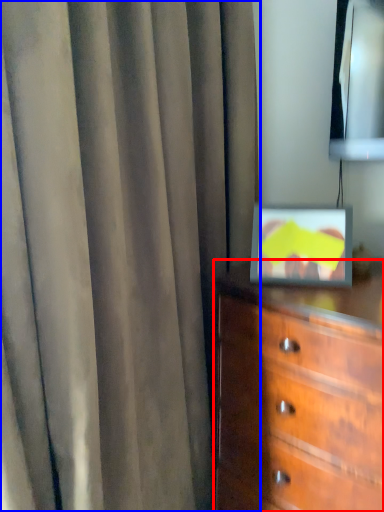
Question: Which object is closer to the camera taking this photo, chest of drawers (highlighted by a red box) or curtain (highlighted by a blue box)?

Choices:
 (A) chest of drawers
 (B) curtain

Answer: (B)